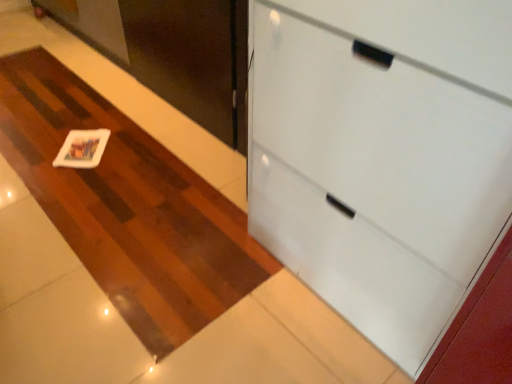
Question: From a real-world perspective, is white matte card at center above or below white matte coaster at center?

Choices:
 (A) below
 (B) above

Answer: (B)

Question: Considering the positions of point (92, 147) and point (116, 140), is point (92, 147) closer or farther from the camera than point (116, 140)?

Choices:
 (A) closer
 (B) farther

Answer: (A)

Question: Based on their relative distances, which object is farther from the white glossy cabinet at upper right?

Choices:
 (A) white matte card at center
 (B) matte black door at upper left
 (C) white matte coaster at center

Answer: (A)

Question: Estimate the real-world distances between objects in this image. Which object is farther from the matte black door at upper left?

Choices:
 (A) white matte card at center
 (B) white glossy cabinet at upper right
 (C) white matte coaster at center

Answer: (B)